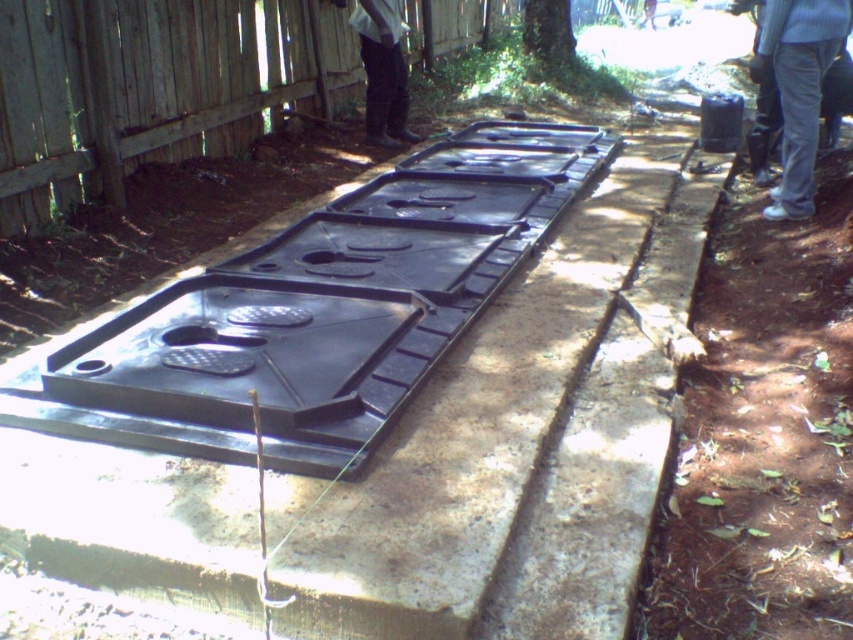
Which is below, gray cotton pants at lower right or white fabric pants at center?

gray cotton pants at lower right

Is gray cotton pants at lower right thinner than white fabric pants at center?

Correct, gray cotton pants at lower right's width is less than white fabric pants at center's.

Image resolution: width=853 pixels, height=640 pixels. Identify the location of gray cotton pants at lower right. [798, 86].

Does wooden fence at upper left appear on the left side of gray cotton pants at lower right?

Correct, you'll find wooden fence at upper left to the left of gray cotton pants at lower right.

Does point (500, 10) come farther from viewer compared to point (798, 90)?

That is True.

Locate an element on the screen. This screenshot has width=853, height=640. wooden fence at upper left is located at coordinates (151, 88).

Can you confirm if black plastic tank at center is taller than gray cotton pants at lower right?

Yes, black plastic tank at center is taller than gray cotton pants at lower right.

Does black plastic tank at center appear over gray cotton pants at lower right?

Incorrect, black plastic tank at center is not positioned above gray cotton pants at lower right.

Does point (567, 278) come closer to viewer compared to point (822, 0)?

That is True.

You are a GUI agent. You are given a task and a screenshot of the screen. Output one action in this format:
    pyautogui.click(x=<x>, y=<y>)
    Task: Click on the black plastic tank at center
    
    Given the screenshot: What is the action you would take?
    pyautogui.click(x=368, y=410)